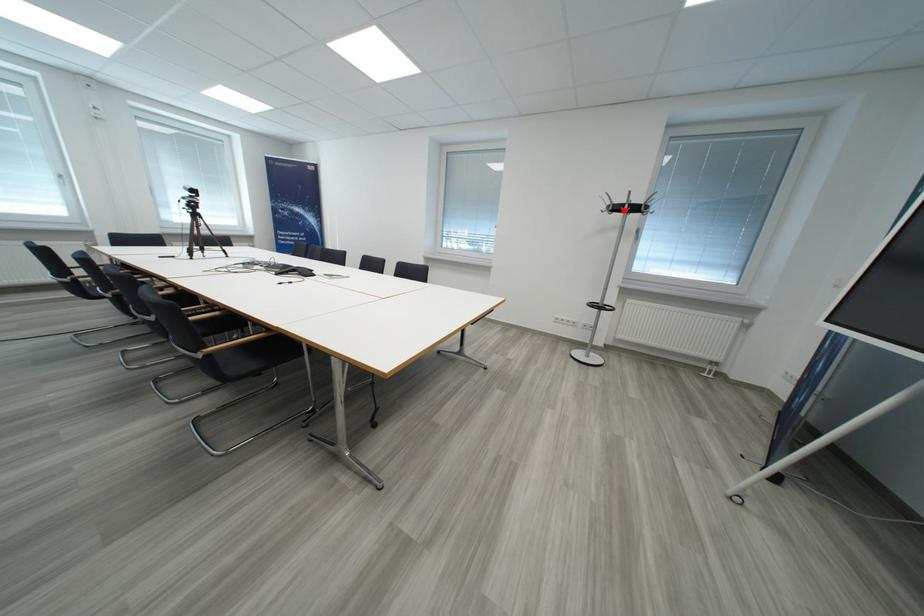
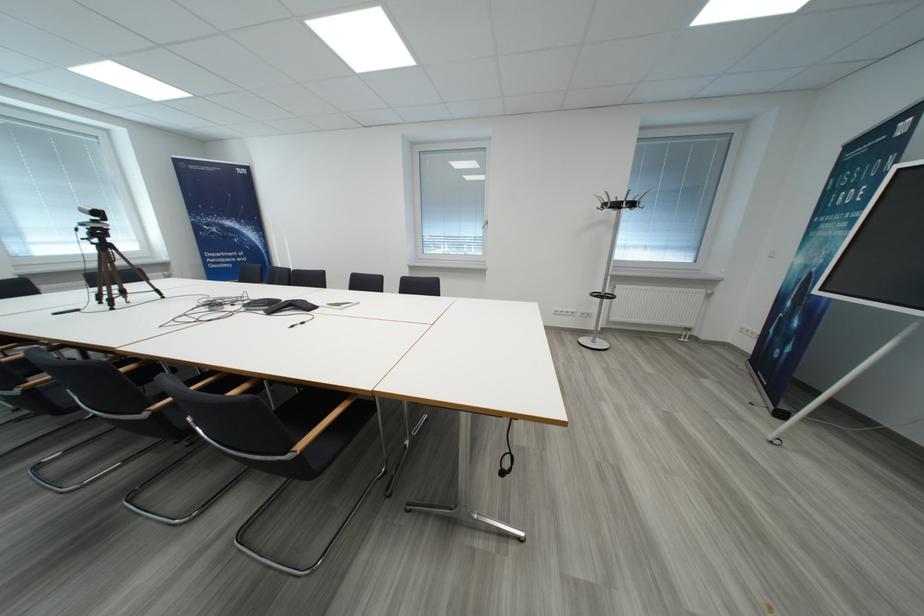
Locate, in the second image, the point that corresponds to the highlighted location in the first image.

(623, 208)